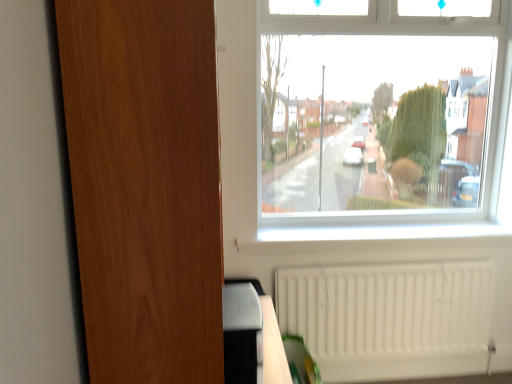
Question: From their relative heights in the image, would you say white matte radiator at lower right is taller or shorter than wooden screen door at left?

Choices:
 (A) short
 (B) tall

Answer: (A)

Question: Would you say white matte radiator at lower right is inside or outside wooden screen door at left?

Choices:
 (A) inside
 (B) outside

Answer: (B)

Question: Based on their sizes in the image, would you say white matte radiator at lower right is bigger or smaller than wooden screen door at left?

Choices:
 (A) big
 (B) small

Answer: (B)

Question: In terms of size, does wooden screen door at left appear bigger or smaller than white matte radiator at lower right?

Choices:
 (A) big
 (B) small

Answer: (A)

Question: Based on their positions, is wooden screen door at left located to the left or right of white matte radiator at lower right?

Choices:
 (A) right
 (B) left

Answer: (B)

Question: Considering their positions, is wooden screen door at left located in front of or behind white matte radiator at lower right?

Choices:
 (A) behind
 (B) front

Answer: (B)

Question: From the image's perspective, relative to white matte radiator at lower right, is wooden screen door at left above or below?

Choices:
 (A) above
 (B) below

Answer: (A)